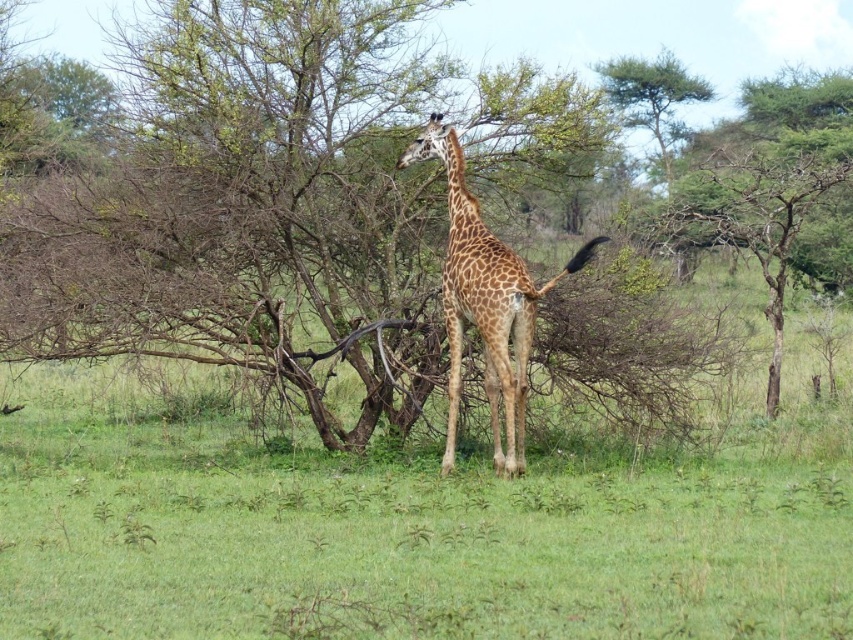
Question: Among these points, which one is farthest from the camera?

Choices:
 (A) (344, 193)
 (B) (665, 141)
 (C) (483, 298)

Answer: (B)

Question: Is brown leafless tree at center positioned before spotted fur giraffe at center?

Choices:
 (A) no
 (B) yes

Answer: (A)

Question: Is the position of brown leafless tree at center more distant than that of green leafy tree at upper center?

Choices:
 (A) yes
 (B) no

Answer: (B)

Question: Which point is farther to the camera?

Choices:
 (A) (65, 285)
 (B) (656, 100)
 (C) (492, 420)

Answer: (B)

Question: Based on their relative distances, which object is nearer to the spotted fur giraffe at center?

Choices:
 (A) green leafy tree at upper center
 (B) brown leafless tree at center

Answer: (B)

Question: Does brown leafless tree at center lie behind green leafy tree at upper center?

Choices:
 (A) no
 (B) yes

Answer: (A)